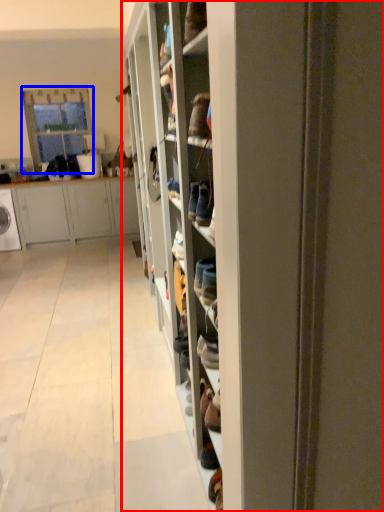
Question: Among these objects, which one is farthest to the camera, shelf (highlighted by a red box) or glass door (highlighted by a blue box)?

Choices:
 (A) shelf
 (B) glass door

Answer: (B)